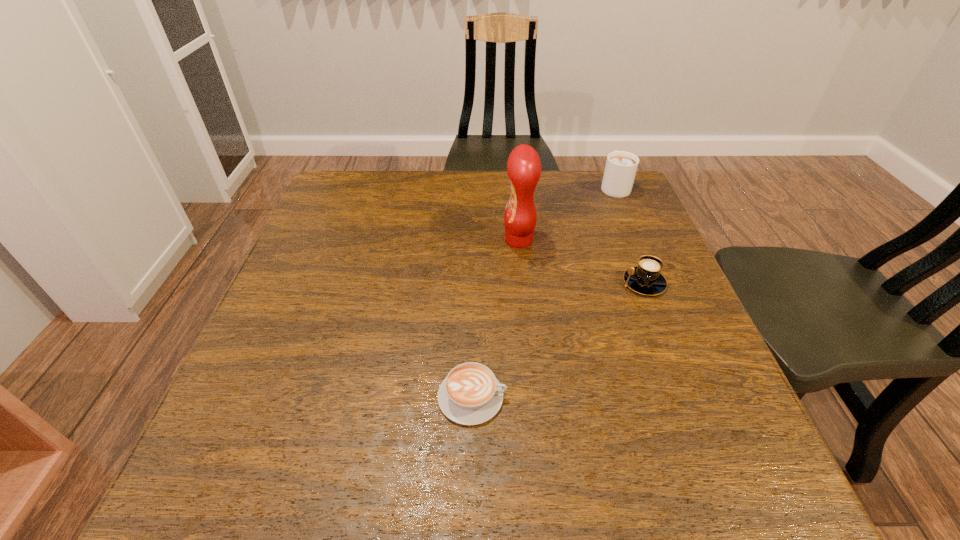
Image resolution: width=960 pixels, height=540 pixels. What are the coordinates of `vacant region located 0.400m on the label side of the condiment` in the screenshot? It's located at (343, 240).

This screenshot has width=960, height=540. I want to click on free spot located 0.310m on the left of the third farthest object, so click(x=484, y=282).

This screenshot has width=960, height=540. Find the location of `vacant space situated 0.390m on the side of the shortest cappuccino with the handle`. vacant space situated 0.390m on the side of the shortest cappuccino with the handle is located at coordinates (729, 397).

In order to click on object at the far edge in this screenshot , I will do `click(621, 166)`.

I want to click on object that is at the far right corner, so click(621, 166).

In order to click on vacant region at the far edge in this screenshot , I will do `click(444, 180)`.

What are the coordinates of `free region at the near edge` in the screenshot? It's located at (421, 450).

The width and height of the screenshot is (960, 540). I want to click on free point at the left edge, so click(313, 262).

You are a GUI agent. You are given a task and a screenshot of the screen. Output one action in this format:
    pyautogui.click(x=<x>, y=<y>)
    Task: Click on the blank space at the right edge
    
    Given the screenshot: What is the action you would take?
    pyautogui.click(x=717, y=442)

In the image, there is a desktop. Identify the location of vacant space at the far left corner. (334, 172).